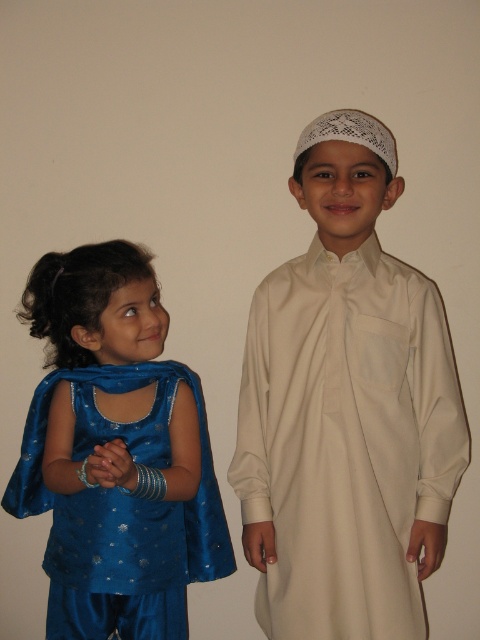
Based on the photo, you are a photographer setting up for a group photo. You have to position the white matte kufi at center and the shiny blue dress at left so that both fit within a frame that can only accommodate objects up to the width of the wider object. Which object should you adjust to ensure they both fit?

The white matte kufi at center has a smaller width than the shiny blue dress at left. To ensure both fit within the frame, adjust the position of the white matte kufi at center so it aligns with the width of the shiny blue dress at left, as the frame can accommodate up to the width of the wider object, which is the shiny blue dress at left.

You are standing 1.5 meters away from the camera. Can you reach the point at coordinates point (302, 513)?

The point at coordinates point (302, 513) is 1.49 meters away from the camera. Since you are standing 1.5 meters away from the camera, you are slightly farther than the point, so you cannot reach it.

You are a photographer setting up for a photo shoot. You need to position a light source to the left of the shiny blue dress at left and another light source to the right of the white matte kufi at center. Will the two light sources be placed on the same side relative to each other?

The white matte kufi at center is to the right of the shiny blue dress at left. Placing a light to the left of the shiny blue dress at left would be on the far left, while placing another light to the right of the white matte kufi at center would be further to the right. Therefore, the two light sources will not be on the same side relative to each other.